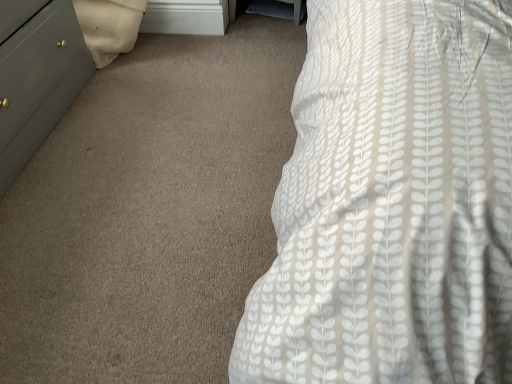
Identify the location of matte gray dresser at left. Image resolution: width=512 pixels, height=384 pixels. (38, 82).

This screenshot has width=512, height=384. What do you see at coordinates (38, 82) in the screenshot? I see `matte gray dresser at left` at bounding box center [38, 82].

Image resolution: width=512 pixels, height=384 pixels. What do you see at coordinates (186, 17) in the screenshot? I see `white matte file cabinet at upper center` at bounding box center [186, 17].

The height and width of the screenshot is (384, 512). In order to click on white matte file cabinet at upper center in this screenshot , I will do `click(186, 17)`.

At what (x,y) coordinates should I click in order to perform the action: click on matte gray dresser at left. Please return your answer as a coordinate pair (x, y). The height and width of the screenshot is (384, 512). Looking at the image, I should click on (38, 82).

Is matte gray dresser at left to the right of white matte file cabinet at upper center from the viewer's perspective?

Incorrect, matte gray dresser at left is not on the right side of white matte file cabinet at upper center.

Which object is further away from the camera taking this photo, matte gray dresser at left or white matte file cabinet at upper center?

white matte file cabinet at upper center is more distant.

Does point (86, 56) appear closer or farther from the camera than point (196, 34)?

Point (86, 56) appears to be closer to the viewer than point (196, 34).

From the image's perspective, who appears lower, matte gray dresser at left or white matte file cabinet at upper center?

matte gray dresser at left appears lower in the image.

From a real-world perspective, is matte gray dresser at left positioned above or below white matte file cabinet at upper center?

From a real-world perspective, matte gray dresser at left is physically above white matte file cabinet at upper center.

Looking at this image, can you confirm if matte gray dresser at left is wider than white matte file cabinet at upper center?

Yes, matte gray dresser at left is wider than white matte file cabinet at upper center.

Can you confirm if matte gray dresser at left is shorter than white matte file cabinet at upper center?

In fact, matte gray dresser at left may be taller than white matte file cabinet at upper center.

Who is bigger, matte gray dresser at left or white matte file cabinet at upper center?

Bigger between the two is matte gray dresser at left.

Can white matte file cabinet at upper center be found inside matte gray dresser at left?

That's incorrect, white matte file cabinet at upper center is not inside matte gray dresser at left.

Are matte gray dresser at left and white matte file cabinet at upper center far apart?

No, matte gray dresser at left is not far from white matte file cabinet at upper center.

Is matte gray dresser at left facing away from white matte file cabinet at upper center?

No, matte gray dresser at left is not facing the opposite direction of white matte file cabinet at upper center.

Can you tell me how much matte gray dresser at left and white matte file cabinet at upper center differ in facing direction?

There is a 88.1-degree angle between the facing directions of matte gray dresser at left and white matte file cabinet at upper center.

How distant is matte gray dresser at left from white matte file cabinet at upper center?

They are 26.06 inches apart.

The width and height of the screenshot is (512, 384). I want to click on chest of drawers above the white matte file cabinet at upper center (from a real-world perspective), so click(x=38, y=82).

Considering the relative positions of white matte file cabinet at upper center and matte gray dresser at left in the image provided, is white matte file cabinet at upper center to the left of matte gray dresser at left from the viewer's perspective?

In fact, white matte file cabinet at upper center is to the right of matte gray dresser at left.

Based on the photo, which is behind, white matte file cabinet at upper center or matte gray dresser at left?

white matte file cabinet at upper center is further away from the camera.

Is point (189, 6) less distant than point (4, 153)?

That is False.

From the image's perspective, is white matte file cabinet at upper center beneath matte gray dresser at left?

Actually, white matte file cabinet at upper center appears above matte gray dresser at left in the image.

From a real-world perspective, is white matte file cabinet at upper center located higher than matte gray dresser at left?

No, from a real-world perspective, white matte file cabinet at upper center is not over matte gray dresser at left

Looking at their sizes, would you say white matte file cabinet at upper center is wider or thinner than matte gray dresser at left?

Clearly, white matte file cabinet at upper center has less width compared to matte gray dresser at left.

In the scene shown: Considering the relative sizes of white matte file cabinet at upper center and matte gray dresser at left in the image provided, is white matte file cabinet at upper center taller than matte gray dresser at left?

Incorrect, the height of white matte file cabinet at upper center is not larger of that of matte gray dresser at left.

Is white matte file cabinet at upper center smaller than matte gray dresser at left?

Yes.

Is matte gray dresser at left a part of white matte file cabinet at upper center?

No, matte gray dresser at left is not inside white matte file cabinet at upper center.

Is white matte file cabinet at upper center next to matte gray dresser at left and touching it?

No, white matte file cabinet at upper center is not touching matte gray dresser at left.

Is matte gray dresser at left at the back of white matte file cabinet at upper center?

That's not correct — white matte file cabinet at upper center is not looking away from matte gray dresser at left.

Identify the location of file cabinet behind the matte gray dresser at left. The height and width of the screenshot is (384, 512). (186, 17).

Where is `the chest of drawers in front of the white matte file cabinet at upper center`? This screenshot has width=512, height=384. the chest of drawers in front of the white matte file cabinet at upper center is located at coordinates (38, 82).

The width and height of the screenshot is (512, 384). Find the location of `file cabinet below the matte gray dresser at left (from a real-world perspective)`. file cabinet below the matte gray dresser at left (from a real-world perspective) is located at coordinates click(186, 17).